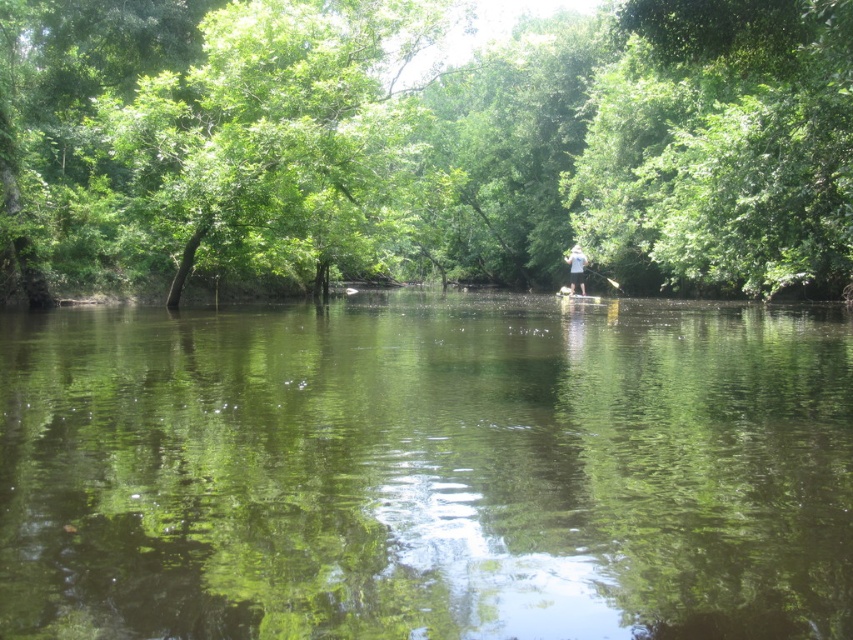
You are standing at the camera position and want to take a photo of the green leafy tree at center. If your camera has a maximum focus range of 12 meters, will you be able to capture the tree clearly?

The green leafy tree at center is 12.60 meters away from the camera. Since the camera can only focus up to 12 meters, it won cannot capture the tree clearly.

You are a photographer trying to capture the reflection of the trees in the water. The green reflective water at center and the white cotton shirt at center are both in your camera frame. Which object should you focus on to ensure the reflection is clearly visible?

You should focus on the green reflective water at center because it is wider than the white cotton shirt at center, providing a larger surface to capture the reflection of the trees.